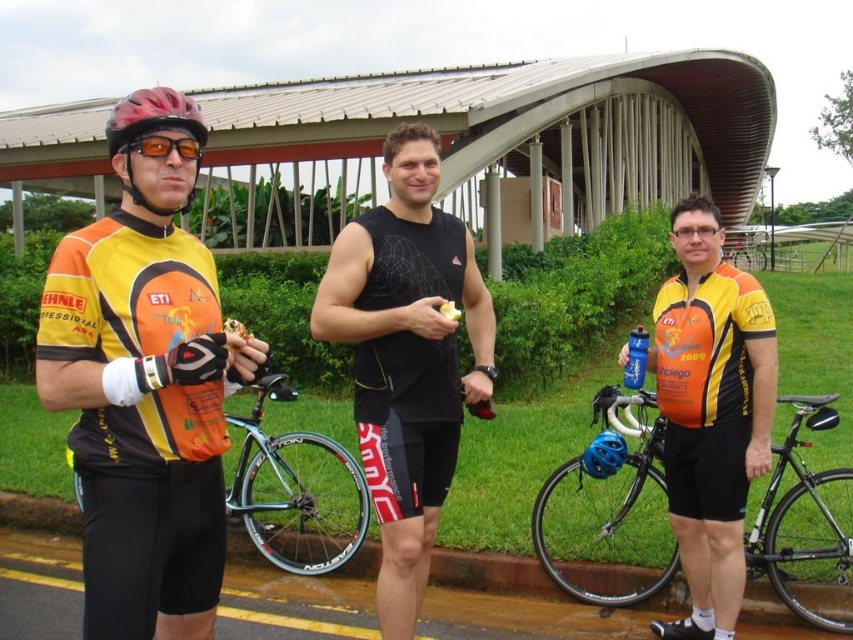
Question: Is matte black cycling jersey at left smaller than matte black helmet at left?

Choices:
 (A) no
 (B) yes

Answer: (B)

Question: Can you confirm if matte black helmet at left is positioned to the left of blue matte helmet at center?

Choices:
 (A) no
 (B) yes

Answer: (B)

Question: Does matte orange cycling jersey at center appear on the left side of blue matte helmet at center?

Choices:
 (A) yes
 (B) no

Answer: (B)

Question: Which of the following is the farthest from the observer?

Choices:
 (A) blue matte helmet at center
 (B) matte orange cycling jersey at center
 (C) shiny black frame at center

Answer: (C)

Question: Which point appears farthest from the camera in this image?

Choices:
 (A) (253, 515)
 (B) (194, 128)
 (C) (195, 156)

Answer: (A)

Question: Which point is farther from the camera taking this photo?

Choices:
 (A) (604, 454)
 (B) (312, 438)

Answer: (B)